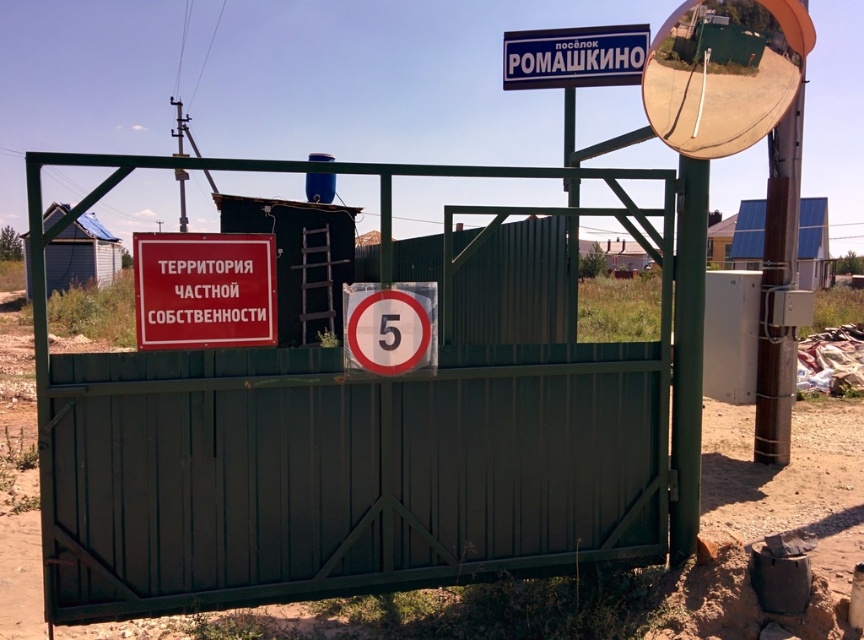
You are standing in front of the green metal gate with two points marked on it. The first point is at coordinate (442, 474) and the second is at (570, 35). Which of these points is nearer to you?

Point (442, 474) is closer to the camera than point (570, 35), so the first point is nearer to you.

You are a delivery driver approaching the green painted metal gate at center and the red matte sign at center. The delivery instructions say to pass through the larger object. Which object should you choose?

The green painted metal gate at center is larger in size than the red matte sign at center, so you should choose the green painted metal gate at center to pass through.